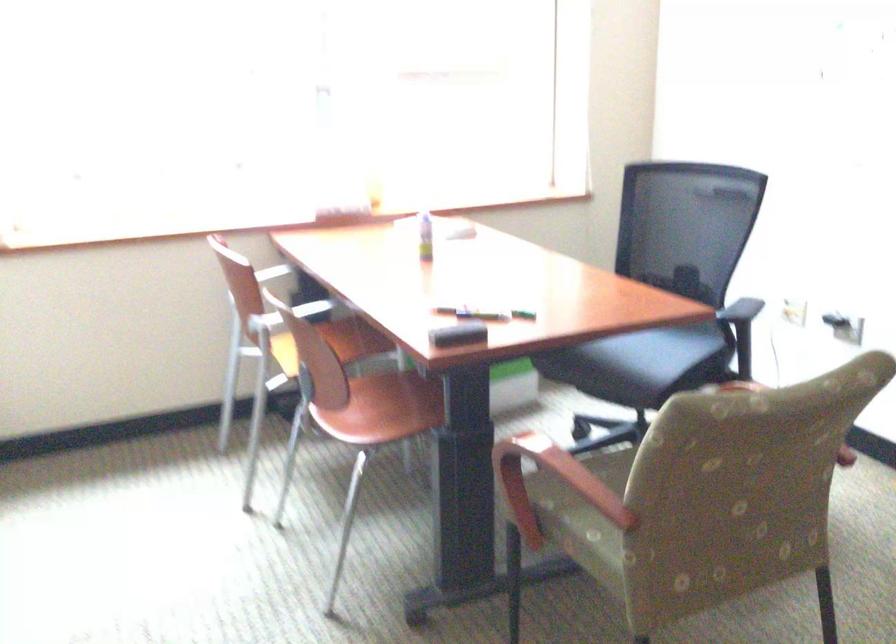
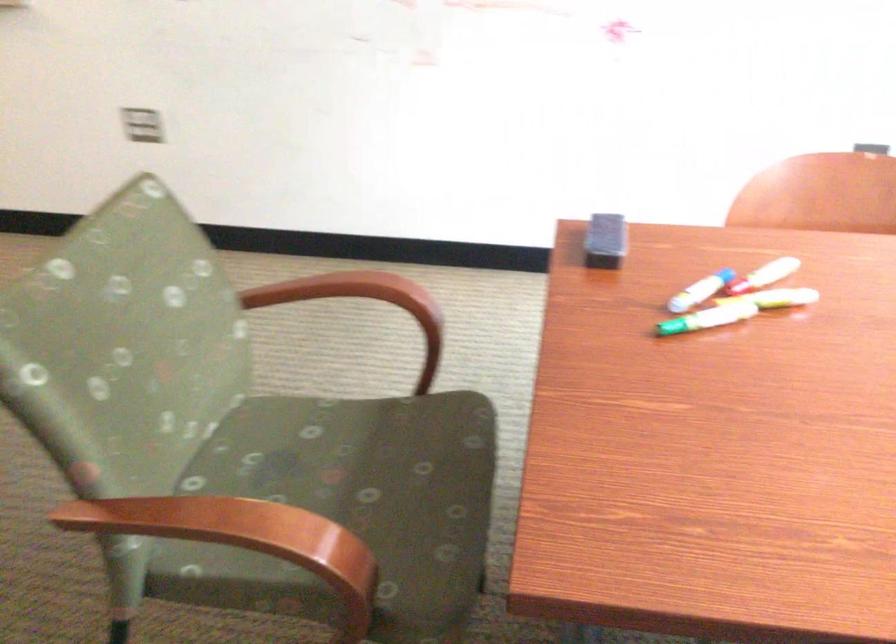
In the second image, find the point that corresponds to (479,313) in the first image.

(700, 290)